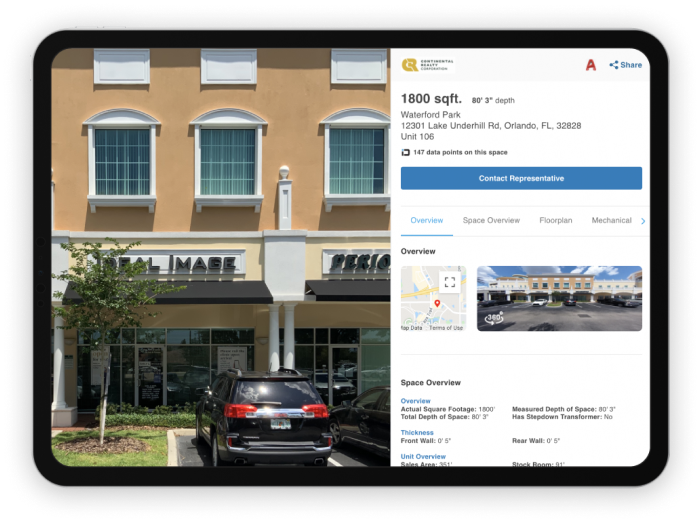
Where is `namer plate`? The width and height of the screenshot is (700, 523). namer plate is located at coordinates (281, 424).